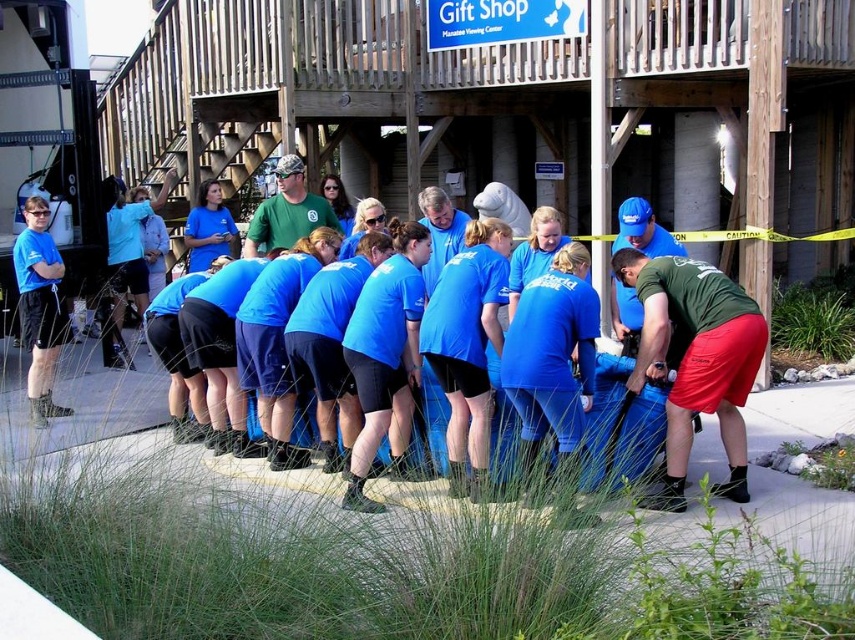
You are standing at the position of the point labeled point (40, 212) and want to walk to the wooden structure with the Gift Shop sign. Which direction should you move relative to the point labeled point (646, 364)?

Since point (646, 364) is in front of point (40, 212), you should move towards the direction away from point (646, 364) to reach the wooden structure with the Gift Shop sign.